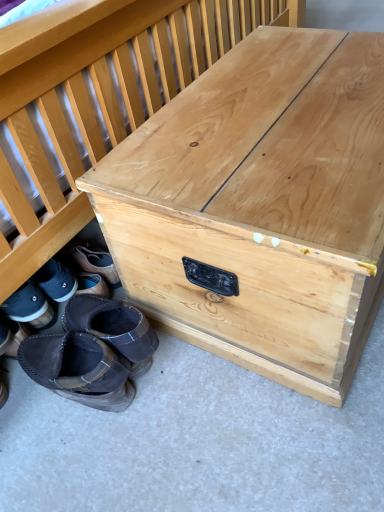
Question: From the image's perspective, is natural wood trunk at center positioned above or below brown suede boot at lower left, the fourth footwear in the left-to-right sequence?

Choices:
 (A) above
 (B) below

Answer: (A)

Question: Considering the positions of natural wood trunk at center and brown suede boot at lower left, the 2th footwear positioned from the right, in the image, is natural wood trunk at center bigger or smaller than brown suede boot at lower left, the 2th footwear positioned from the right,?

Choices:
 (A) small
 (B) big

Answer: (B)

Question: Which is farther from the brown suede boot at lower left, the fourth footwear in the left-to-right sequence?

Choices:
 (A) leather boots at lower left, positioned as the third footwear in right-to-left order
 (B) natural wood trunk at center
 (C) brown suede boot at lower left, acting as the 5th footwear starting from the right
 (D) dark brown suede moccasin at lower left, the fifth footwear in the left-to-right sequence
 (E) black suede boot at lower left, marked as the fourth footwear in a right-to-left arrangement

Answer: (B)

Question: Which object is the farthest from the natural wood trunk at center?

Choices:
 (A) leather boots at lower left, which is counted as the third footwear, starting from the left
 (B) dark brown suede moccasin at lower left, the fifth footwear in the left-to-right sequence
 (C) black suede boot at lower left, marked as the fourth footwear in a right-to-left arrangement
 (D) brown suede boot at lower left, acting as the 5th footwear starting from the right
 (E) brown suede boot at lower left, the fourth footwear in the left-to-right sequence

Answer: (D)